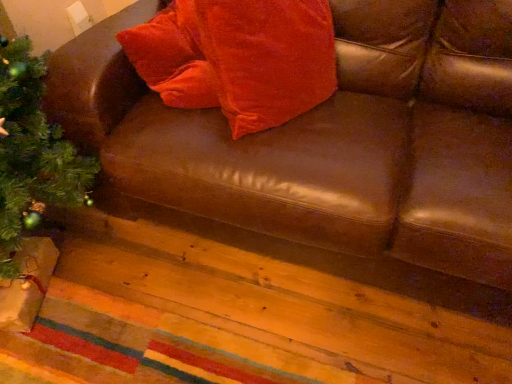
In order to face velvet orange pillow at upper center, should I rotate leftwards or rightwards?

To align with it, rotate right about 2.316°.

The width and height of the screenshot is (512, 384). What do you see at coordinates (267, 58) in the screenshot?
I see `velvet orange pillow at upper center` at bounding box center [267, 58].

You are a GUI agent. You are given a task and a screenshot of the screen. Output one action in this format:
    pyautogui.click(x=<x>, y=<y>)
    Task: Click on the velvet orange pillow at upper center
    
    Given the screenshot: What is the action you would take?
    pyautogui.click(x=267, y=58)

Identify the location of velvet orange pillow at upper center. (267, 58).